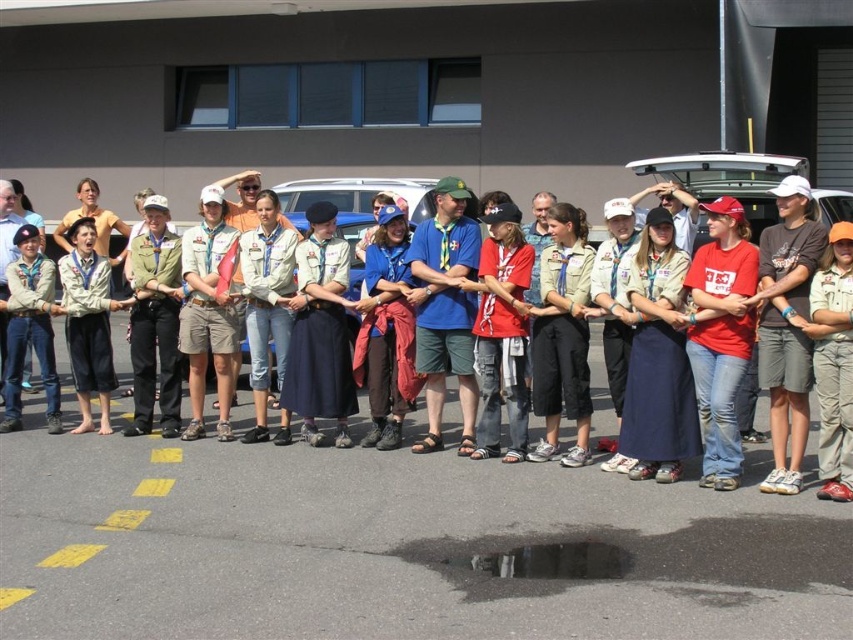
You are standing in the parking lot and want to know how far the point at coordinates [178,420] is from your current position. Can you determine the distance?

The point at coordinates [178,420] is 8.48 meters away from your current position.

You are organizing a group photo and need to arrange two participants wearing the blue fabric shirt at center and khaki uniform skirt at center. Based on their current positions, which participant should stand to the left to maintain their original spatial relationship?

The khaki uniform skirt at center should stand to the left because the blue fabric shirt at center is currently positioned on the right side of the khaki uniform skirt at center, so maintaining that relationship would require the khaki uniform skirt at center to be on the left and the blue fabric shirt at center on the right.

You are a photographer trying to capture a photo of the red cotton shirt at center and the khaki shorts at center. The camera has a minimum focus distance of 7 feet. Can you take a photo of both objects without moving the camera?

The red cotton shirt at center and khaki shorts at center are 8.08 feet apart from each other, which is greater than the camera minimum focus distance of 7 feet. Therefore, the camera can focus on both objects simultaneously and take the photo without moving the camera.